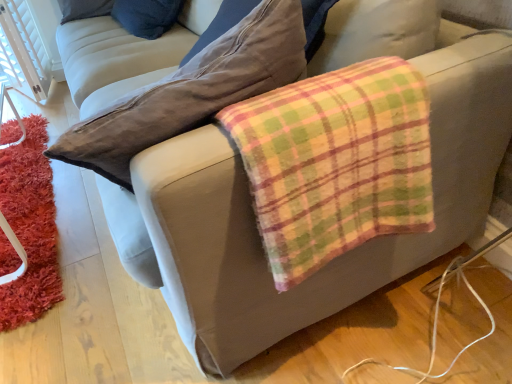
Question: Should I look upward or downward to see fluffy orange rug at lower left?

Choices:
 (A) down
 (B) up

Answer: (A)

Question: Is fluffy orange rug at lower left not near plaid flannel blanket at lower right?

Choices:
 (A) no
 (B) yes

Answer: (B)

Question: Could you tell me if fluffy orange rug at lower left is turned towards plaid flannel blanket at lower right?

Choices:
 (A) no
 (B) yes

Answer: (A)

Question: Does fluffy orange rug at lower left have a lesser height compared to plaid flannel blanket at lower right?

Choices:
 (A) no
 (B) yes

Answer: (B)

Question: From a real-world perspective, is fluffy orange rug at lower left located beneath plaid flannel blanket at lower right?

Choices:
 (A) no
 (B) yes

Answer: (B)

Question: From the image's perspective, is fluffy orange rug at lower left over plaid flannel blanket at lower right?

Choices:
 (A) yes
 (B) no

Answer: (B)

Question: Can you confirm if fluffy orange rug at lower left is thinner than plaid flannel blanket at lower right?

Choices:
 (A) no
 (B) yes

Answer: (A)

Question: Is plaid flannel blanket at lower right shorter than fluffy orange rug at lower left?

Choices:
 (A) yes
 (B) no

Answer: (B)

Question: Is fluffy orange rug at lower left completely or partially inside plaid flannel blanket at lower right?

Choices:
 (A) yes
 (B) no

Answer: (B)

Question: Could you tell me if plaid flannel blanket at lower right is turned towards fluffy orange rug at lower left?

Choices:
 (A) yes
 (B) no

Answer: (B)

Question: Can you confirm if plaid flannel blanket at lower right is bigger than fluffy orange rug at lower left?

Choices:
 (A) yes
 (B) no

Answer: (A)

Question: Does plaid flannel blanket at lower right touch fluffy orange rug at lower left?

Choices:
 (A) yes
 (B) no

Answer: (B)

Question: Considering the relative positions of plaid flannel blanket at lower right and fluffy orange rug at lower left in the image provided, is plaid flannel blanket at lower right to the left of fluffy orange rug at lower left from the viewer's perspective?

Choices:
 (A) no
 (B) yes

Answer: (A)

Question: From a real-world perspective, relative to plaid flannel blanket at lower right, is fluffy orange rug at lower left vertically above or below?

Choices:
 (A) above
 (B) below

Answer: (B)